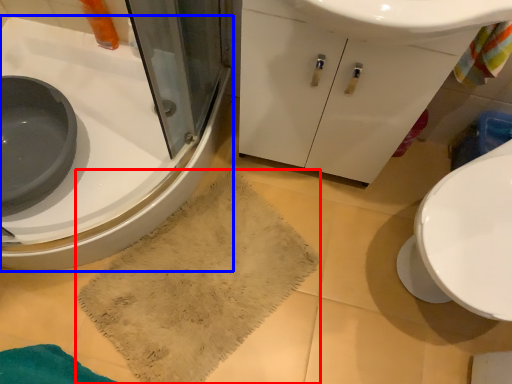
Question: Which of the following is the closest to the observer, bath towel (highlighted by a red box) or sink (highlighted by a blue box)?

Choices:
 (A) bath towel
 (B) sink

Answer: (B)